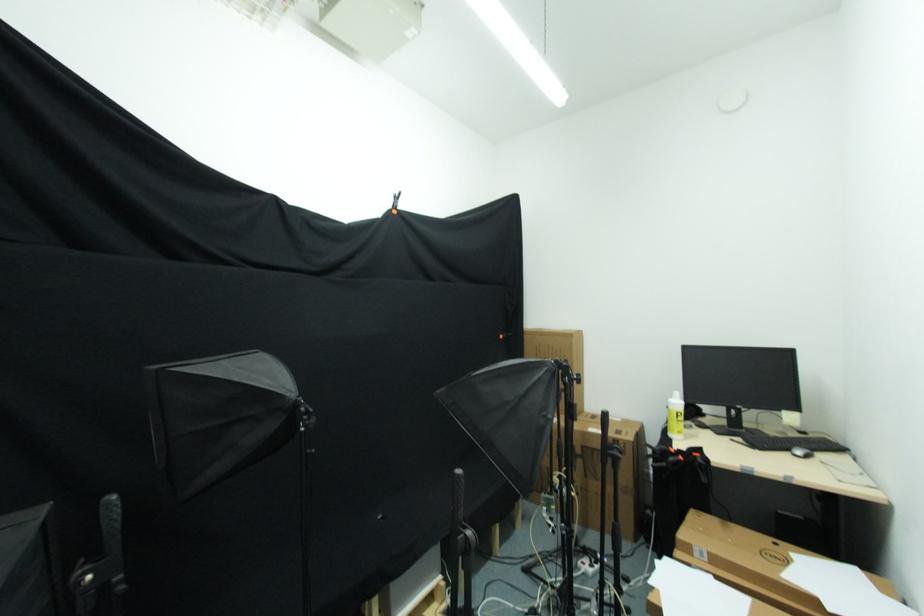
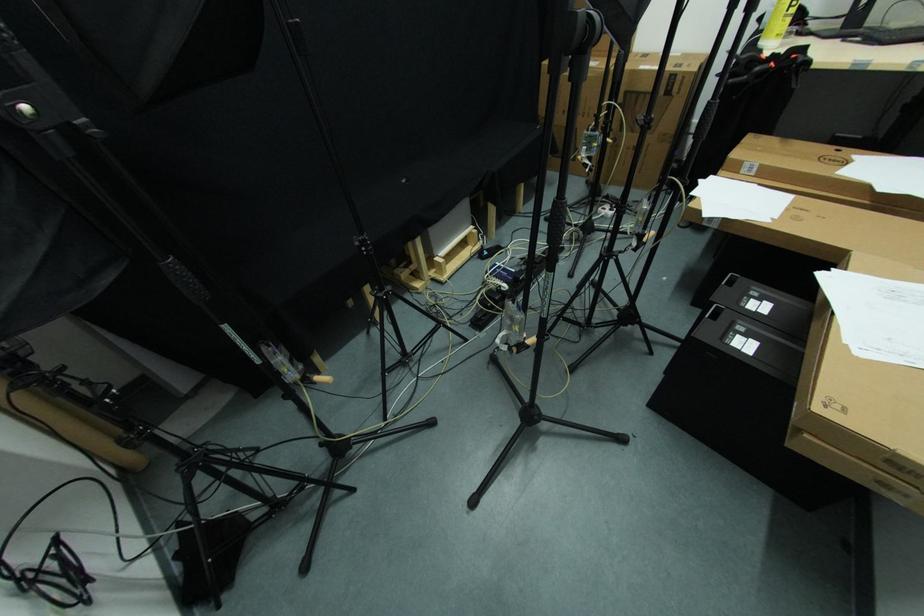
Question: How did the camera likely rotate?

Choices:
 (A) Left
 (B) Right
 (C) Up
 (D) Down

Answer: (D)